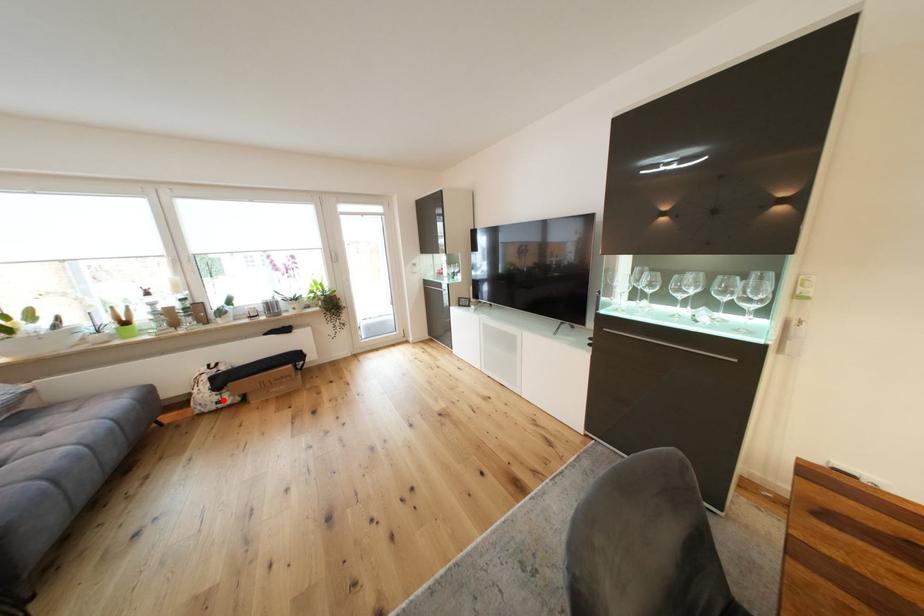
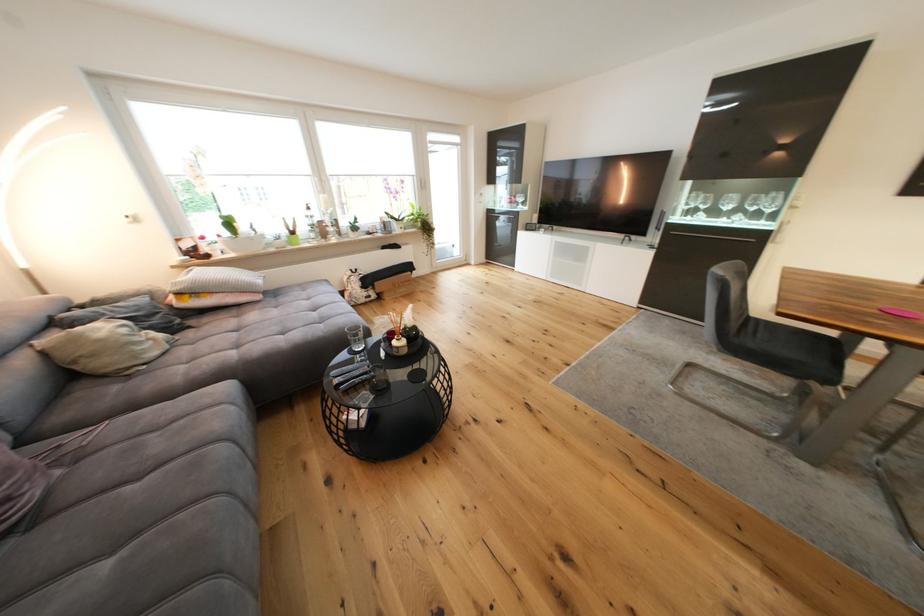
Question: A red point is marked in image1. In image2, is the corresponding 3D point closer to the camera or farther? Reply with the corresponding letter.

Choices:
 (A) The corresponding 3D point is closer.
 (B) The corresponding 3D point is farther.

Answer: (A)